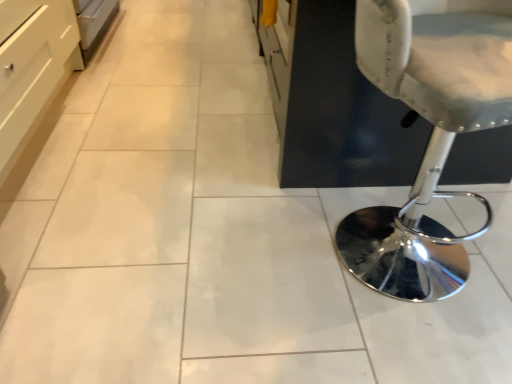
You are a GUI agent. You are given a task and a screenshot of the screen. Output one action in this format:
    pyautogui.click(x=<x>, y=<y>)
    Task: Click on the vacant space to the left of white leather stool at right
    The height and width of the screenshot is (384, 512).
    Given the screenshot: What is the action you would take?
    pyautogui.click(x=255, y=254)